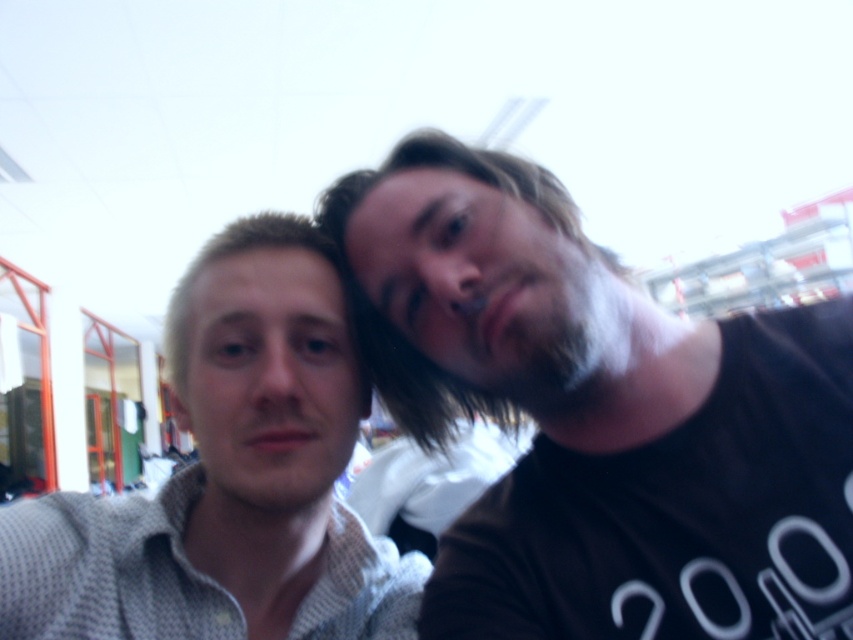
Question: Is dark brown t-shirt at center to the left of light gray textured shirt at left from the viewer's perspective?

Choices:
 (A) yes
 (B) no

Answer: (B)

Question: Estimate the real-world distances between objects in this image. Which object is closer to the dark brown t-shirt at center?

Choices:
 (A) dark brown fuzzy beard at center
 (B) light gray textured shirt at left

Answer: (A)

Question: Estimate the real-world distances between objects in this image. Which object is farther from the dark brown t-shirt at center?

Choices:
 (A) dark brown fuzzy beard at center
 (B) light gray textured shirt at left

Answer: (B)

Question: Which point is closer to the camera?

Choices:
 (A) dark brown fuzzy beard at center
 (B) dark brown t-shirt at center

Answer: (B)

Question: Can you confirm if dark brown t-shirt at center is positioned to the right of light gray textured shirt at left?

Choices:
 (A) yes
 (B) no

Answer: (A)

Question: Where is light gray textured shirt at left located in relation to dark brown fuzzy beard at center in the image?

Choices:
 (A) left
 (B) right

Answer: (A)